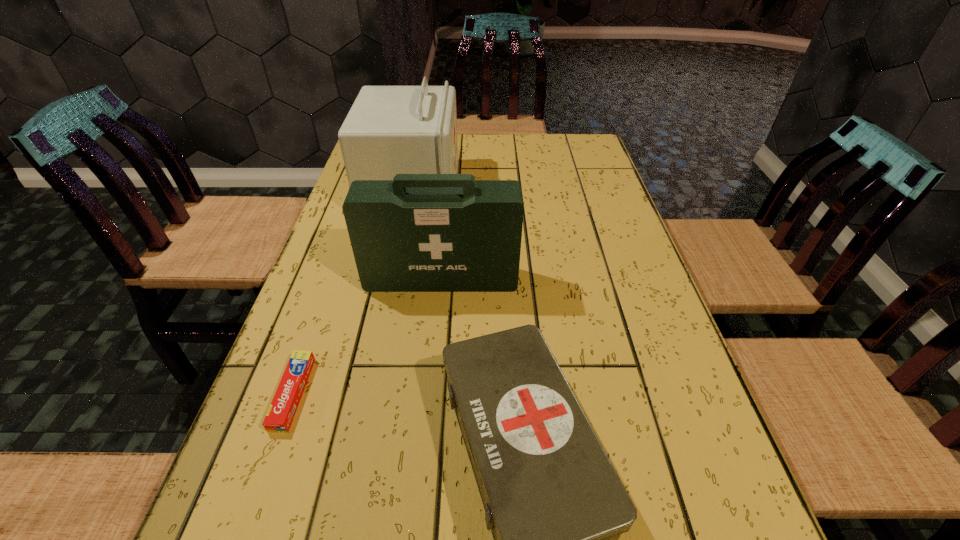
The image size is (960, 540). In order to click on the farthest object in this screenshot , I will do `click(389, 130)`.

You are a GUI agent. You are given a task and a screenshot of the screen. Output one action in this format:
    pyautogui.click(x=<x>, y=<y>)
    Task: Click on the second farthest first-aid kit
    The image size is (960, 540).
    Given the screenshot: What is the action you would take?
    pyautogui.click(x=418, y=232)

What are the coordinates of `the shortest object` in the screenshot? It's located at (279, 417).

The image size is (960, 540). In order to click on free spot located 0.380m on the front-facing side of the farthest object in this screenshot , I will do `click(585, 188)`.

This screenshot has width=960, height=540. In order to click on blank area located on the front-facing side of the second farthest object in this screenshot , I will do `click(426, 440)`.

Where is `blank area located on the right of the shortest object`? This screenshot has height=540, width=960. blank area located on the right of the shortest object is located at coordinates (453, 394).

Where is `object that is at the far edge`? The height and width of the screenshot is (540, 960). object that is at the far edge is located at coordinates (389, 130).

Where is `toothpaste that is at the left edge`? toothpaste that is at the left edge is located at coordinates (279, 417).

Locate an element on the screen. object that is at the far left corner is located at coordinates (389, 130).

Where is `vacant region at the far edge of the desktop`? This screenshot has width=960, height=540. vacant region at the far edge of the desktop is located at coordinates (505, 141).